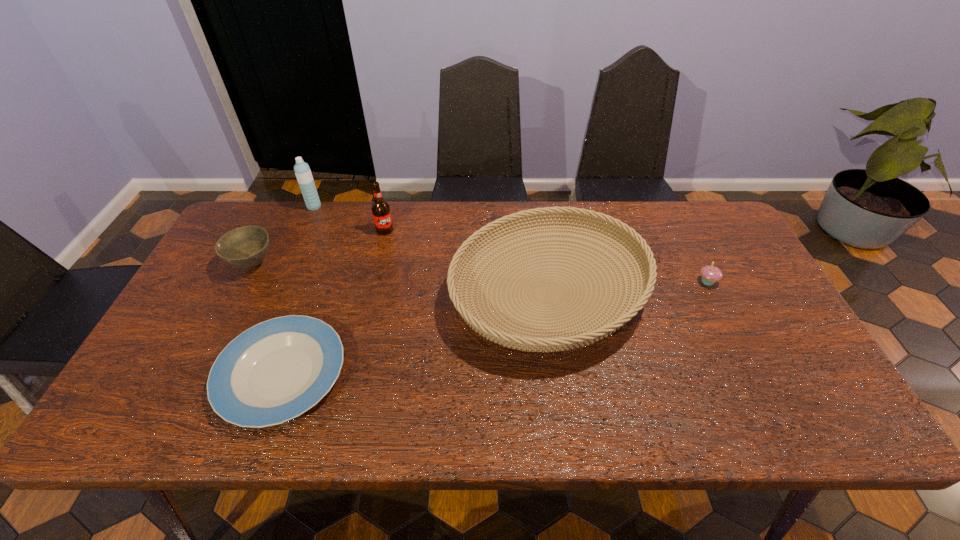
The image size is (960, 540). Find the location of `free location located on the back of the bowl`. free location located on the back of the bowl is located at coordinates (281, 207).

I want to click on free space located 0.220m on the front of the cupcake, so click(744, 355).

Find the location of a particular element. This screenshot has height=540, width=960. free spot located on the right of the shortest object is located at coordinates (379, 374).

The width and height of the screenshot is (960, 540). What are the coordinates of `water bottle that is at the far edge` in the screenshot? It's located at (302, 170).

Locate an element on the screen. Image resolution: width=960 pixels, height=540 pixels. root beer that is at the far edge is located at coordinates (380, 208).

The image size is (960, 540). I want to click on basket present at the far edge, so click(x=514, y=336).

You are a GUI agent. You are given a task and a screenshot of the screen. Output one action in this format:
    pyautogui.click(x=<x>, y=<y>)
    Task: Click on the bowl present at the far edge
    The width and height of the screenshot is (960, 540).
    Given the screenshot: What is the action you would take?
    (x=246, y=247)

What are the coordinates of `object present at the near edge` in the screenshot? It's located at (275, 371).

Identify the location of object that is positioned at the left edge. The height and width of the screenshot is (540, 960). (246, 247).

Locate an element on the screen. The width and height of the screenshot is (960, 540). object present at the right edge is located at coordinates click(710, 274).